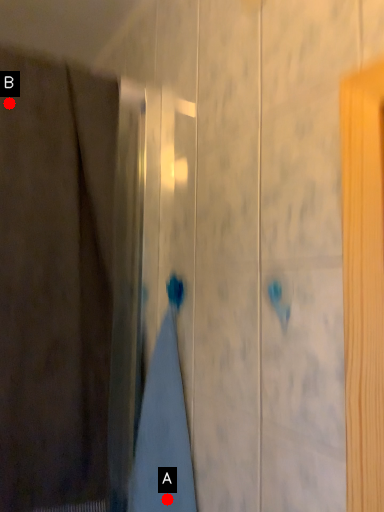
Question: Two points are circled on the image, labeled by A and B beside each circle. Which point is closer to the camera?

Choices:
 (A) A is closer
 (B) B is closer

Answer: (A)